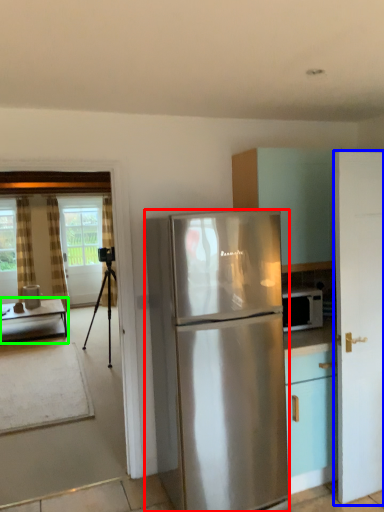
Question: Based on their relative distances, which object is farther from refrigerator (highlighted by a red box)? Choose from door (highlighted by a blue box) and table (highlighted by a green box).

Choices:
 (A) door
 (B) table

Answer: (B)